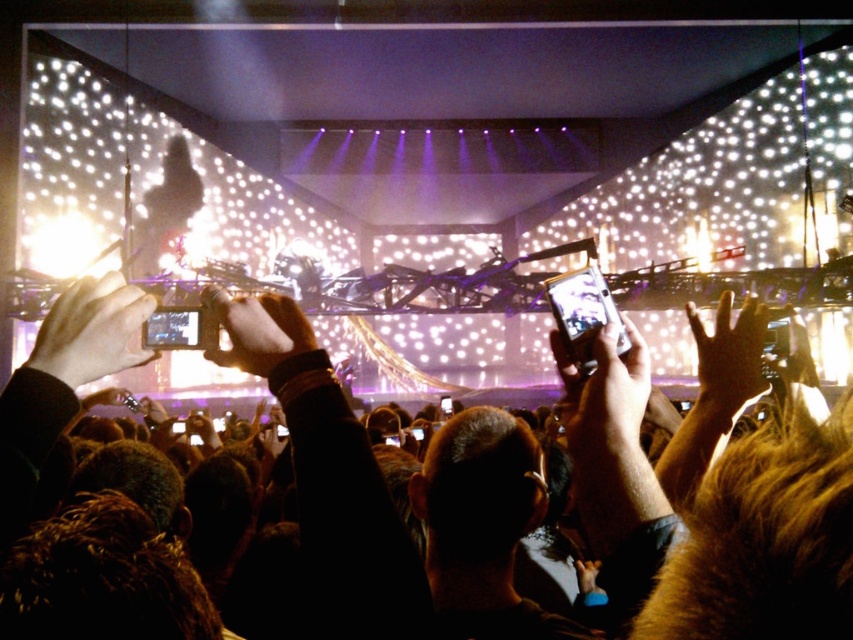
Question: Which of the following is the closest to the observer?

Choices:
 (A) white matte phone at center
 (B) dark brown leather jacket at center
 (C) smooth skin hand at center

Answer: (B)

Question: Which point is closer to the camera?

Choices:
 (A) metallic silver phone at upper center
 (B) smooth skin hand at center

Answer: (A)

Question: Is metallic silver phone at upper center above smooth skin hand at upper right?

Choices:
 (A) no
 (B) yes

Answer: (B)

Question: Is smooth skin hand at upper right smaller than white matte phone at center?

Choices:
 (A) yes
 (B) no

Answer: (B)

Question: Which object is farther from the camera taking this photo?

Choices:
 (A) smooth skin hand at upper right
 (B) dark brown leather jacket at center

Answer: (A)

Question: Does dark brown leather jacket at center have a larger size compared to smooth skin hand at center?

Choices:
 (A) no
 (B) yes

Answer: (B)